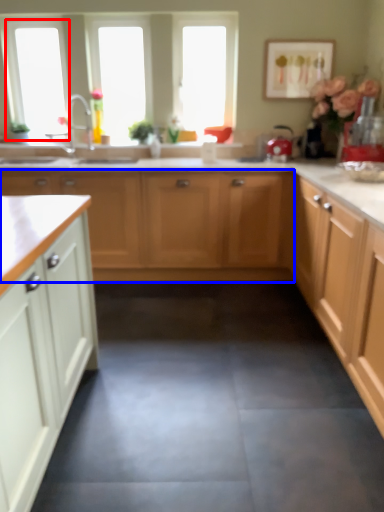
Question: Which of the following is the closest to the observer, window screen (highlighted by a red box) or cabinetry (highlighted by a blue box)?

Choices:
 (A) window screen
 (B) cabinetry

Answer: (B)